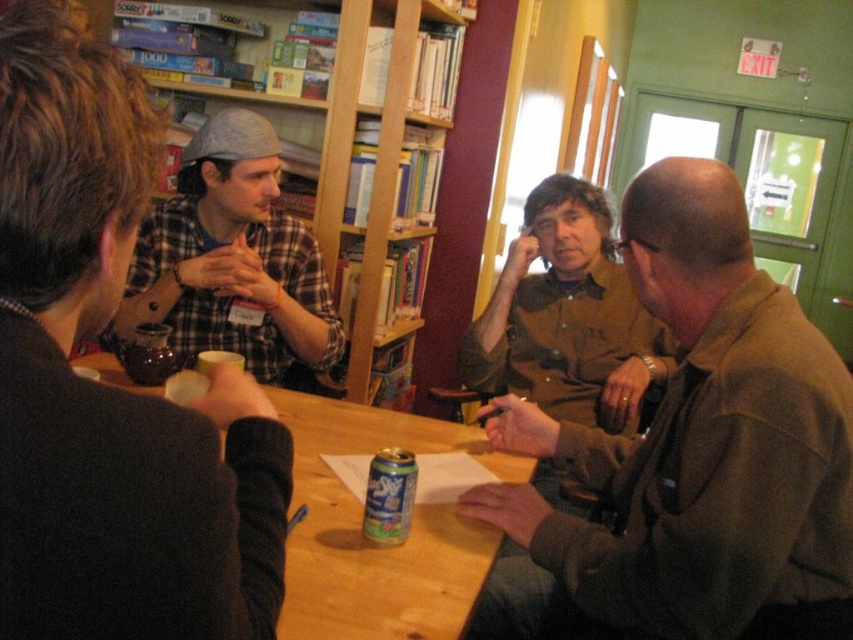
You are standing at the entrance of the room. You see a point marked at coordinates (691, 456). What object is located at that point?

The point at coordinates (691, 456) corresponds to the brown leather jacket at upper right.

You are standing in front of the wooden table where four people are seated. There are two points marked in the scene, one at point coordinates (195, 236) and the other at (599, 301). Which of these two points is closer to your current position?

Point at coordinates (195, 236) is closer to the viewer than point at coordinates (599, 301).